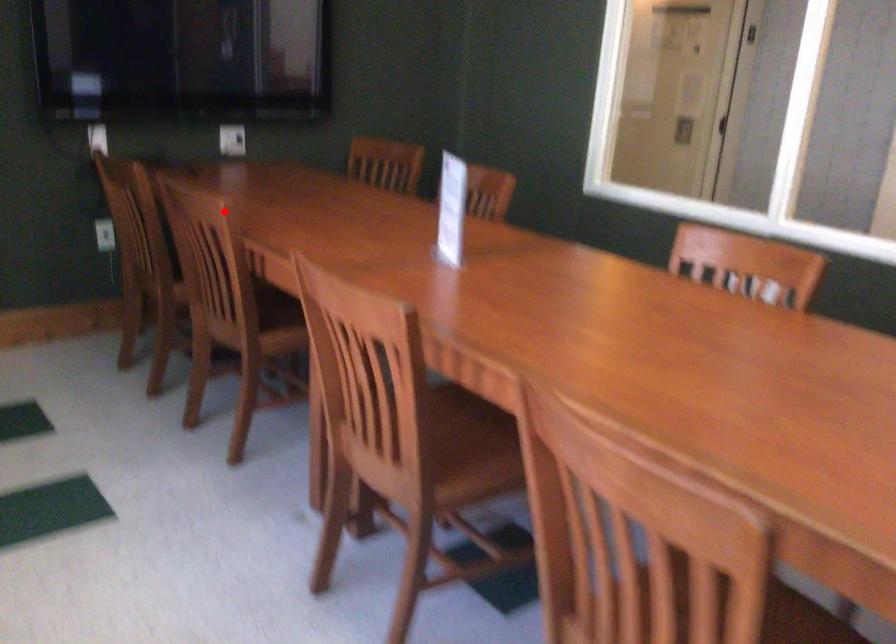
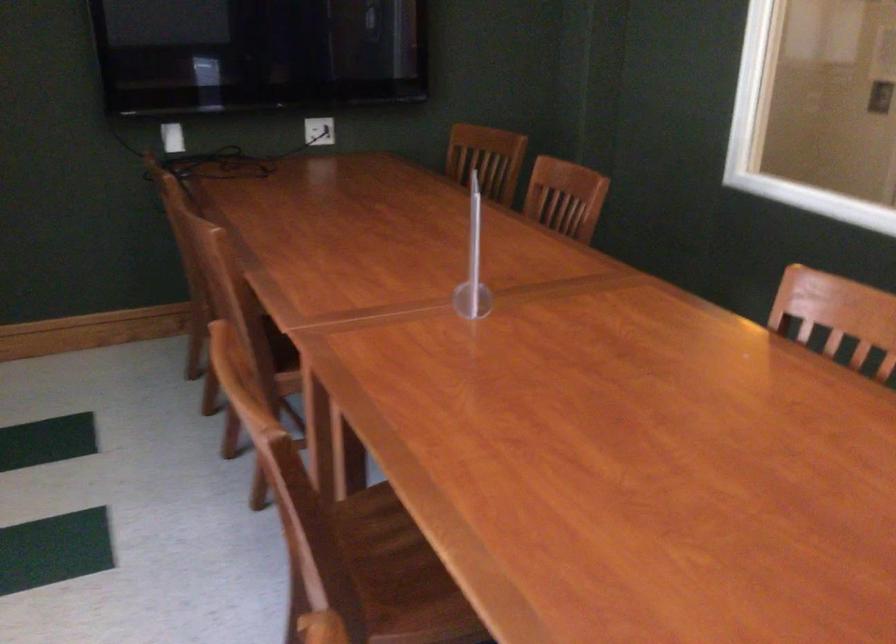
Question: A red point is marked in image1. In image2, is the corresponding 3D point closer to the camera or farther? Reply with the corresponding letter.

Choices:
 (A) The corresponding 3D point is closer.
 (B) The corresponding 3D point is farther.

Answer: (A)